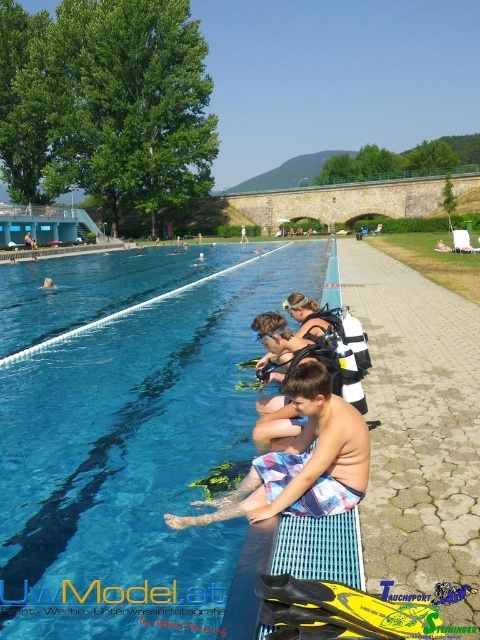
What do you see at coordinates (129, 435) in the screenshot? This screenshot has width=480, height=640. I see `blue smooth water at center` at bounding box center [129, 435].

Does blue smooth water at center have a lesser width compared to multicolored swim trunks at lower center?

No.

Which is behind, point (121, 484) or point (255, 513)?

The point (121, 484) is behind.

Where is `blue smooth water at center`? blue smooth water at center is located at coordinates (129, 435).